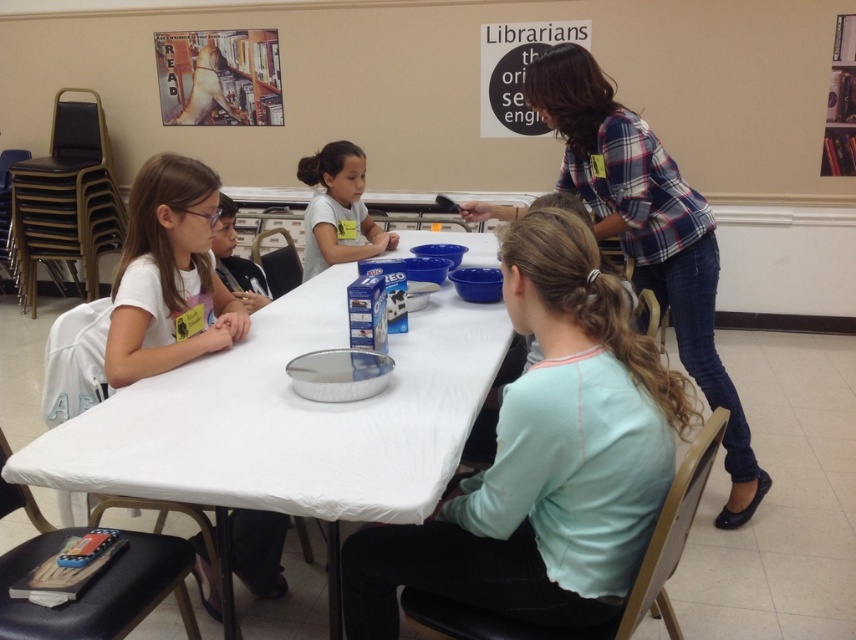
Between light blue fabric shirt at center and white matte shirt at left, which one appears on the left side from the viewer's perspective?

Positioned to the left is white matte shirt at left.

Measure the distance between light blue fabric shirt at center and camera.

light blue fabric shirt at center and camera are 4.18 feet apart from each other.

Find the location of a particular element. light blue fabric shirt at center is located at coordinates (544, 460).

The image size is (856, 640). What do you see at coordinates (544, 460) in the screenshot?
I see `light blue fabric shirt at center` at bounding box center [544, 460].

Measure the distance from light blue fabric shirt at center to light blue shirt at center.

light blue fabric shirt at center and light blue shirt at center are 1.84 meters apart.

Which is behind, point (553, 488) or point (314, 157)?

The point (314, 157) is behind.

Locate an element on the screen. This screenshot has height=640, width=856. light blue fabric shirt at center is located at coordinates (544, 460).

Is white paper table at center in front of white matte shirt at left?

Yes, it is in front of white matte shirt at left.

Between white paper table at center and white matte shirt at left, which one has less height?

white paper table at center

Between point (383, 484) and point (215, 273), which one is positioned behind?

Positioned behind is point (215, 273).

What are the coordinates of `white paper table at center` in the screenshot? It's located at (289, 419).